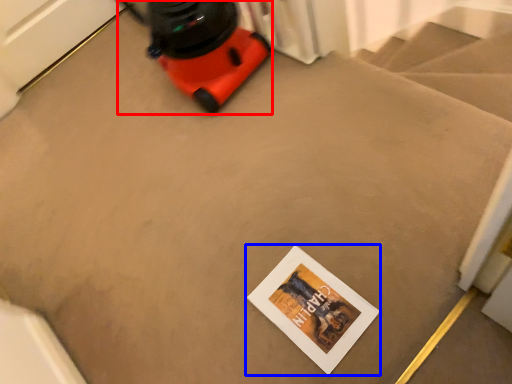
Question: Which object is closer to the camera taking this photo, equipment (highlighted by a red box) or postcard (highlighted by a blue box)?

Choices:
 (A) equipment
 (B) postcard

Answer: (B)